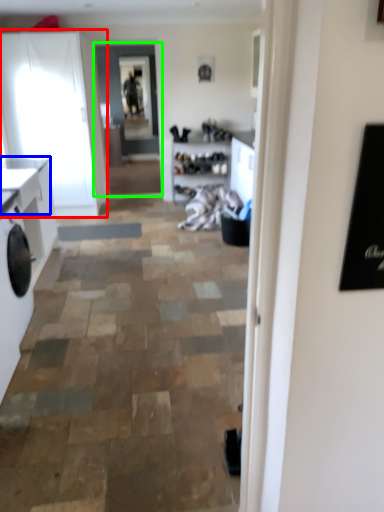
Question: Which is nearer to the cabinetry (highlighted by a red box)? counter top (highlighted by a blue box) or glass door (highlighted by a green box).

Choices:
 (A) counter top
 (B) glass door

Answer: (B)